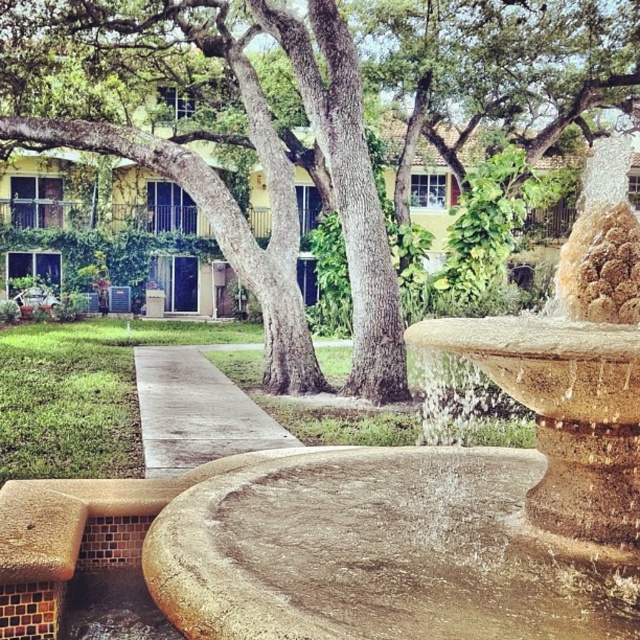
You are standing at the entrance of the garden and see the stone fountain at center and the green textured tree at center. Which object is positioned to the right of the other?

The stone fountain at center is to the right of the green textured tree at center.

You are standing at the entrance of the garden and see the stone fountain at center and the concrete at center. Which object is positioned to the right side?

The stone fountain at center is positioned to the right of the concrete at center.

From the picture: You are standing at the stone fountain and want to walk towards the building behind the large tree. Which point, point (260, 268) or point (186, 392), is closer to your current position?

Point (260, 268) is closer to your current position at the stone fountain because it is further to the viewer than point (186, 392).